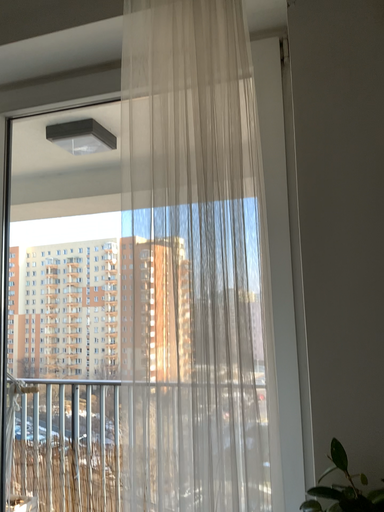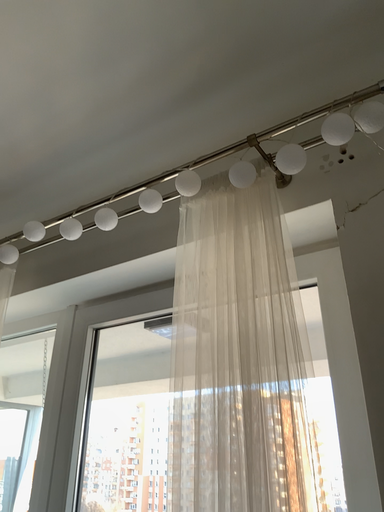
Question: How did the camera likely rotate when shooting the video?

Choices:
 (A) rotated downward
 (B) rotated upward

Answer: (B)